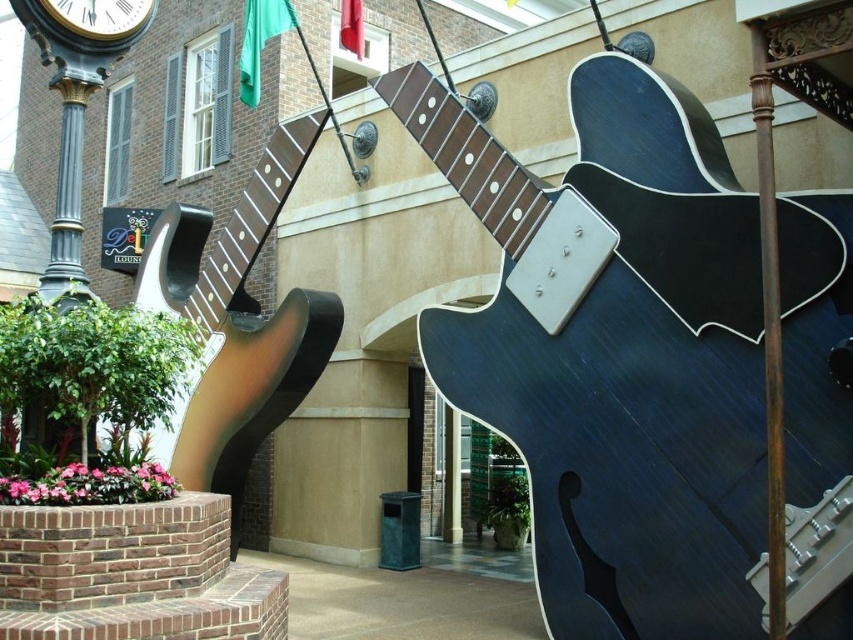
You are a photographer standing in front of the D Lounge building. You want to take a photo that includes both the glossy dark blue guitar at center and the metallic gold clock at upper left. However, you notice that the clock is partially obscured. Based on the scene description, which object is blocking the view of the clock?

The glossy dark blue guitar at center is in front of the metallic gold clock at upper left, so the guitar is blocking the view of the clock.